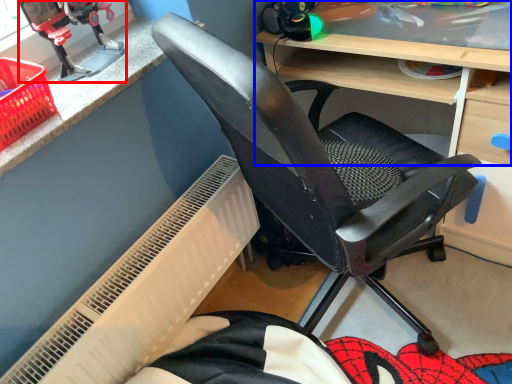
Question: Which point is closer to the camera, sport equipment (highlighted by a red box) or desk (highlighted by a blue box)?

Choices:
 (A) sport equipment
 (B) desk

Answer: (B)